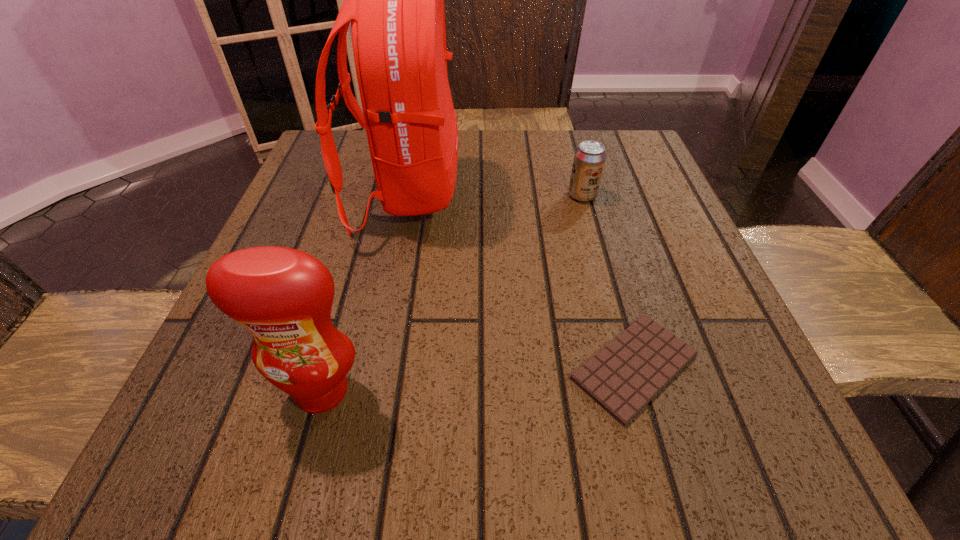
Where is `free space between the backpack and the beer can`? This screenshot has height=540, width=960. free space between the backpack and the beer can is located at coordinates (494, 194).

Locate an element on the screen. Image resolution: width=960 pixels, height=540 pixels. free space between the third shortest object and the shortest object is located at coordinates coord(478,379).

Where is `free space between the third shortest object and the chocolate bar`? This screenshot has width=960, height=540. free space between the third shortest object and the chocolate bar is located at coordinates (478, 379).

Identify the location of unoccupied area between the chocolate bar and the tallest object. (520, 280).

Identify the location of unoccupied position between the tallest object and the beer can. This screenshot has width=960, height=540. coord(494,194).

This screenshot has height=540, width=960. I want to click on the second closest object to the shortest object, so click(283, 296).

Identify which object is the second nearest to the shortest object. Please provide its 2D coordinates. Your answer should be formatted as a tuple, i.e. [(x, y)], where the tuple contains the x and y coordinates of a point satisfying the conditions above.

[(283, 296)]

Where is `free spot that satisfies the following two spatial constraints: 1. on the main compartment of the tallest object; 2. on the back side of the shortest object`? This screenshot has width=960, height=540. free spot that satisfies the following two spatial constraints: 1. on the main compartment of the tallest object; 2. on the back side of the shortest object is located at coordinates (372, 367).

The width and height of the screenshot is (960, 540). What are the coordinates of `free location that satisfies the following two spatial constraints: 1. on the main compartment of the second shortest object; 2. on the right side of the backpack` in the screenshot? It's located at 405,195.

The width and height of the screenshot is (960, 540). In order to click on vacant space that satisfies the following two spatial constraints: 1. on the main compartment of the backpack; 2. on the label side of the condiment in this screenshot , I will do `click(367, 390)`.